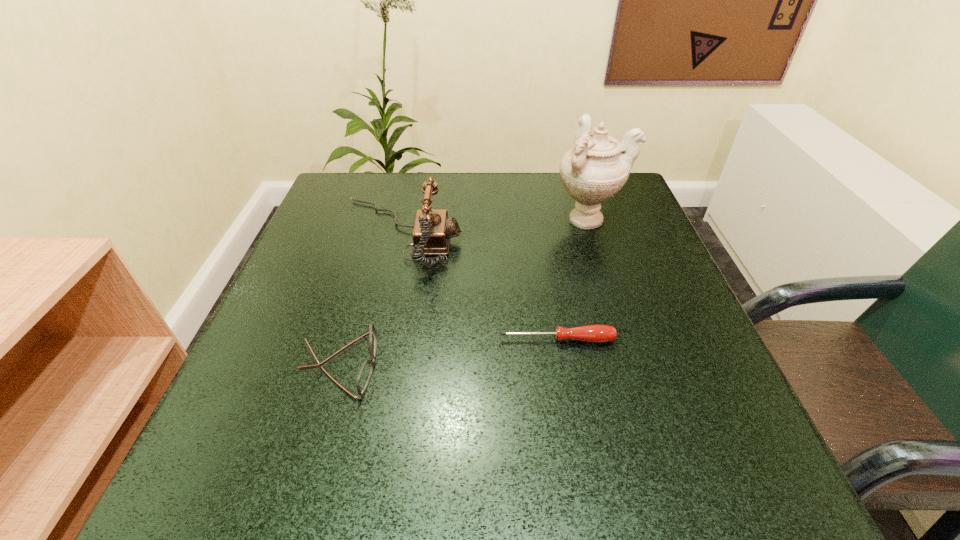
Locate an element on the screen. The image size is (960, 540). telephone located in the left edge section of the desktop is located at coordinates (432, 231).

Locate an element on the screen. The width and height of the screenshot is (960, 540). spectacles positioned at the left edge is located at coordinates (365, 373).

Where is `urn that is at the right edge`? The image size is (960, 540). urn that is at the right edge is located at coordinates (597, 166).

I want to click on screwdriver that is positioned at the right edge, so click(592, 333).

This screenshot has width=960, height=540. I want to click on object located at the far left corner, so click(432, 231).

Find the location of `object situated at the far right corner`. object situated at the far right corner is located at coordinates (597, 166).

This screenshot has height=540, width=960. Find the location of `free location at the far edge of the desktop`. free location at the far edge of the desktop is located at coordinates (551, 178).

Identify the location of vacant space at the left edge. The image size is (960, 540). (240, 428).

Locate an element on the screen. This screenshot has height=540, width=960. vacant space at the right edge of the desktop is located at coordinates (673, 359).

Where is `free region at the far left corner of the desktop`? The height and width of the screenshot is (540, 960). free region at the far left corner of the desktop is located at coordinates (340, 188).